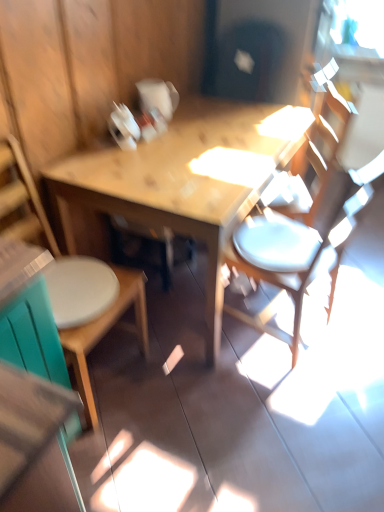
Question: Does wooden table at center have a lesser height compared to wooden chair at left, the second chair when ordered from right to left?

Choices:
 (A) yes
 (B) no

Answer: (A)

Question: Is wooden table at center oriented towards wooden chair at left, the second chair when ordered from right to left?

Choices:
 (A) yes
 (B) no

Answer: (B)

Question: Is wooden table at center with wooden chair at left, which is counted as the first chair, starting from the left?

Choices:
 (A) yes
 (B) no

Answer: (B)

Question: Does wooden table at center have a greater height compared to wooden chair at left, the second chair when ordered from right to left?

Choices:
 (A) no
 (B) yes

Answer: (A)

Question: Considering the relative sizes of wooden table at center and wooden chair at left, which is counted as the first chair, starting from the left, in the image provided, is wooden table at center thinner than wooden chair at left, which is counted as the first chair, starting from the left,?

Choices:
 (A) no
 (B) yes

Answer: (A)

Question: Can you confirm if wooden table at center is positioned to the left of wooden chair at left, which is counted as the first chair, starting from the left?

Choices:
 (A) no
 (B) yes

Answer: (A)

Question: From the image's perspective, does white matte chair at right, which ranks as the 2th chair in left-to-right order, appear lower than wooden table at center?

Choices:
 (A) no
 (B) yes

Answer: (B)

Question: Is white matte chair at right, which ranks as the 2th chair in left-to-right order, outside wooden table at center?

Choices:
 (A) no
 (B) yes

Answer: (B)

Question: Is white matte chair at right, which ranks as the 2th chair in left-to-right order, facing towards wooden table at center?

Choices:
 (A) no
 (B) yes

Answer: (B)

Question: Does white matte chair at right, placed as the 1th chair when sorted from right to left, have a greater height compared to wooden table at center?

Choices:
 (A) yes
 (B) no

Answer: (A)

Question: Can you confirm if white matte chair at right, which ranks as the 2th chair in left-to-right order, is shorter than wooden table at center?

Choices:
 (A) no
 (B) yes

Answer: (A)

Question: Can you confirm if white matte chair at right, which ranks as the 2th chair in left-to-right order, is positioned to the right of wooden table at center?

Choices:
 (A) yes
 (B) no

Answer: (A)

Question: Is white matte chair at right, placed as the 1th chair when sorted from right to left, located within wooden table at center?

Choices:
 (A) yes
 (B) no

Answer: (B)